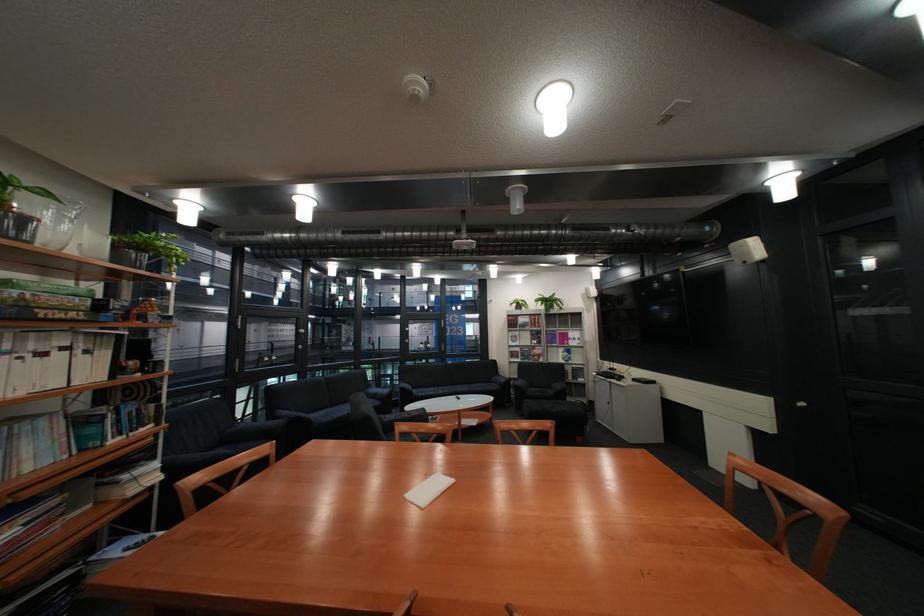
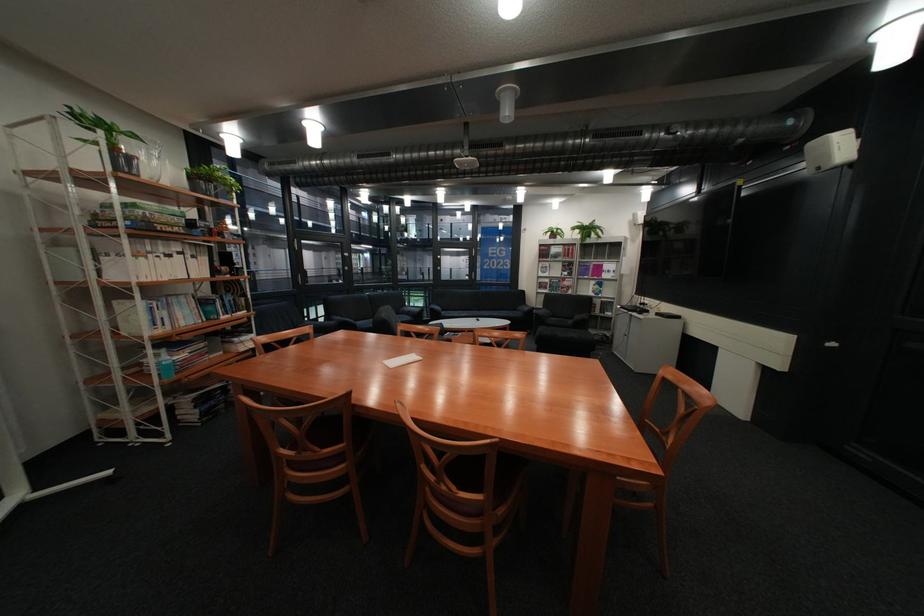
Find the pixel in the second image that matches pixel 521 201 in the first image.

(513, 108)